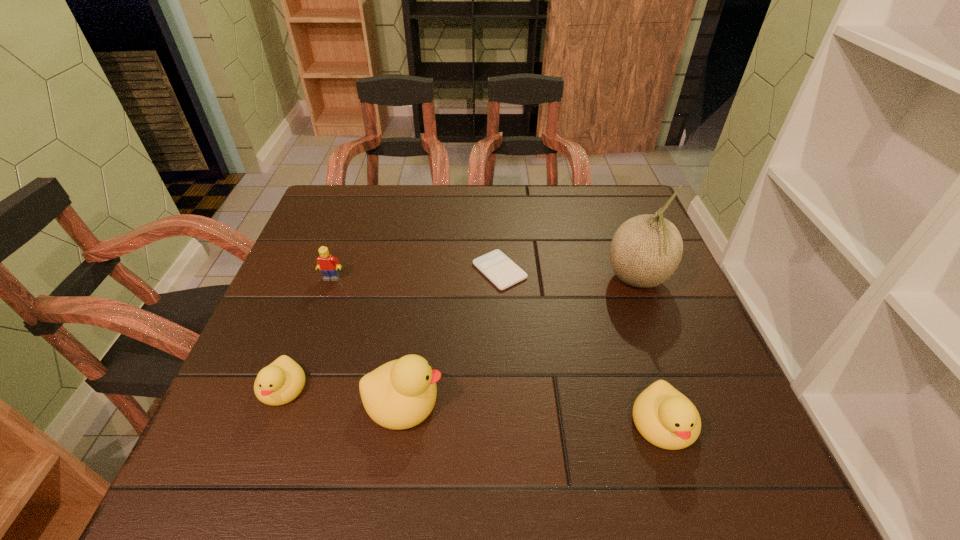
Identify the location of free location at the near edge of the desktop. (449, 414).

Where is `vacant area at the right edge`? This screenshot has height=540, width=960. vacant area at the right edge is located at coordinates (611, 282).

Where is `vacant space at the far left corner of the desktop`? vacant space at the far left corner of the desktop is located at coordinates (372, 197).

The width and height of the screenshot is (960, 540). What are the coordinates of `free space at the near left corner` in the screenshot? It's located at (225, 400).

At what (x,y) coordinates should I click in order to perform the action: click on free spot at the far right corner of the desktop. Please return your answer as a coordinate pair (x, y). The image size is (960, 540). Looking at the image, I should click on (632, 192).

Where is `free space that is in between the fifth tallest object and the tallest object`? The width and height of the screenshot is (960, 540). free space that is in between the fifth tallest object and the tallest object is located at coordinates (460, 334).

The width and height of the screenshot is (960, 540). Identify the location of empty space that is in between the Lego and the shortest object. (416, 274).

The width and height of the screenshot is (960, 540). I want to click on free point between the Lego and the shortest duckling, so click(307, 333).

This screenshot has width=960, height=540. Find the location of `empty space between the Lego and the tallest object`. empty space between the Lego and the tallest object is located at coordinates (485, 279).

Find the location of a particular element. free space between the fifth tallest object and the second duckling from right to left is located at coordinates (343, 394).